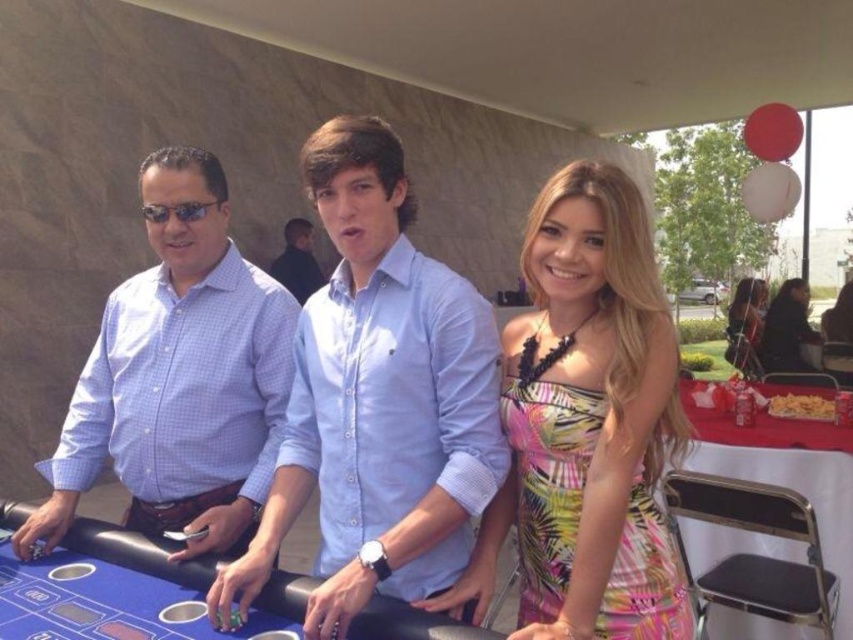
Can you confirm if light blue button-down shirt at center is positioned above white plastic table at right?

Yes, light blue button-down shirt at center is above white plastic table at right.

Is light blue button-down shirt at center to the left of white plastic table at right from the viewer's perspective?

Correct, you'll find light blue button-down shirt at center to the left of white plastic table at right.

This screenshot has width=853, height=640. What do you see at coordinates (378, 401) in the screenshot?
I see `light blue button-down shirt at center` at bounding box center [378, 401].

Where is `light blue button-down shirt at center`? light blue button-down shirt at center is located at coordinates (378, 401).

Which is behind, point (773, 474) or point (312, 275)?

The point (312, 275) is behind.

Is white plastic table at right closer to the viewer compared to dark blue shirt at center?

Yes, it is.

Is point (776, 516) in front of point (285, 275)?

Yes.

Find the location of a particular element. The image size is (853, 640). white plastic table at right is located at coordinates (744, 545).

Does printed silk dress at center appear on the right side of multicolored floral dress at center?

Incorrect, printed silk dress at center is not on the right side of multicolored floral dress at center.

Is printed silk dress at center below multicolored floral dress at center?

Indeed, printed silk dress at center is positioned under multicolored floral dress at center.

Locate an element on the screen. Image resolution: width=853 pixels, height=640 pixels. printed silk dress at center is located at coordinates (585, 424).